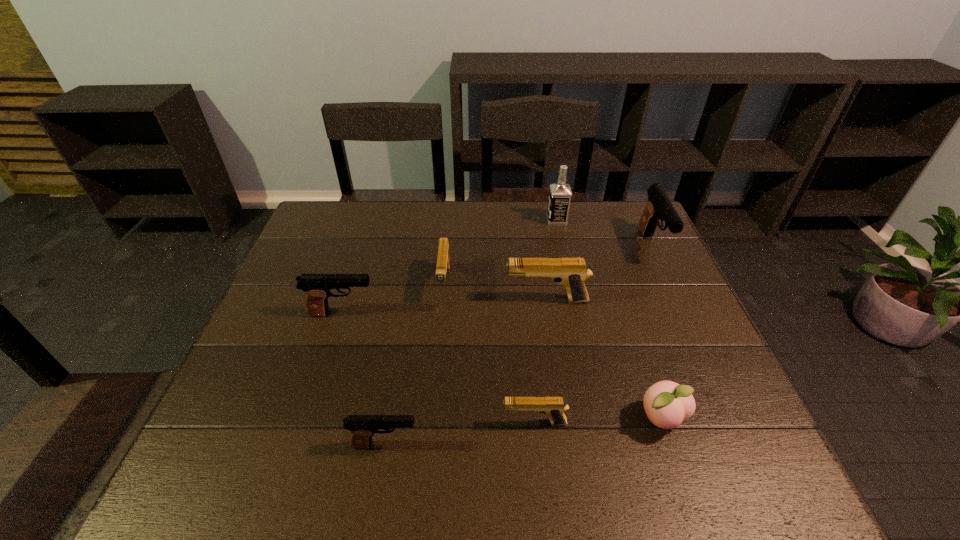
The width and height of the screenshot is (960, 540). What are the coordinates of `vodka` in the screenshot? It's located at (560, 193).

Identify the location of the rightmost black pistol. (659, 206).

What are the coordinates of `the farthest black pistol` in the screenshot? It's located at (659, 206).

Where is `the biggest tan pistol`? Image resolution: width=960 pixels, height=540 pixels. the biggest tan pistol is located at coordinates (570, 272).

This screenshot has height=540, width=960. Identify the location of the fourth farthest pistol. (317, 287).

Find the location of a particular element. Image resolution: width=960 pixels, height=540 pixels. the second farthest black pistol is located at coordinates (317, 287).

The width and height of the screenshot is (960, 540). What are the coordinates of `the third object from left to right` in the screenshot? It's located at (443, 260).

Where is `the third pistol from left to right`? The width and height of the screenshot is (960, 540). the third pistol from left to right is located at coordinates (443, 260).

You are a GUI agent. You are given a task and a screenshot of the screen. Output one action in this format:
    pyautogui.click(x=<x>, y=<y>)
    Task: Click on the peach
    
    Given the screenshot: What is the action you would take?
    pyautogui.click(x=667, y=404)

The width and height of the screenshot is (960, 540). What are the coordinates of `the second object from right to left` in the screenshot? It's located at (667, 404).